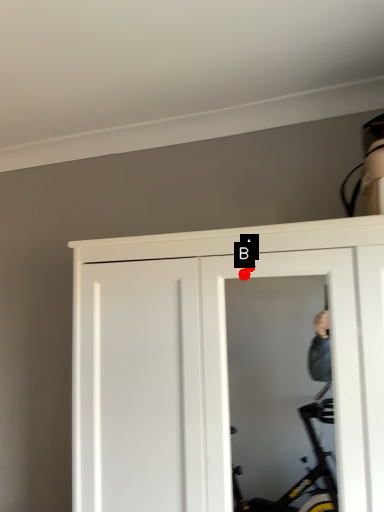
Question: Two points are circled on the image, labeled by A and B beside each circle. Among these points, which one is farthest from the camera?

Choices:
 (A) A is further
 (B) B is further

Answer: (A)